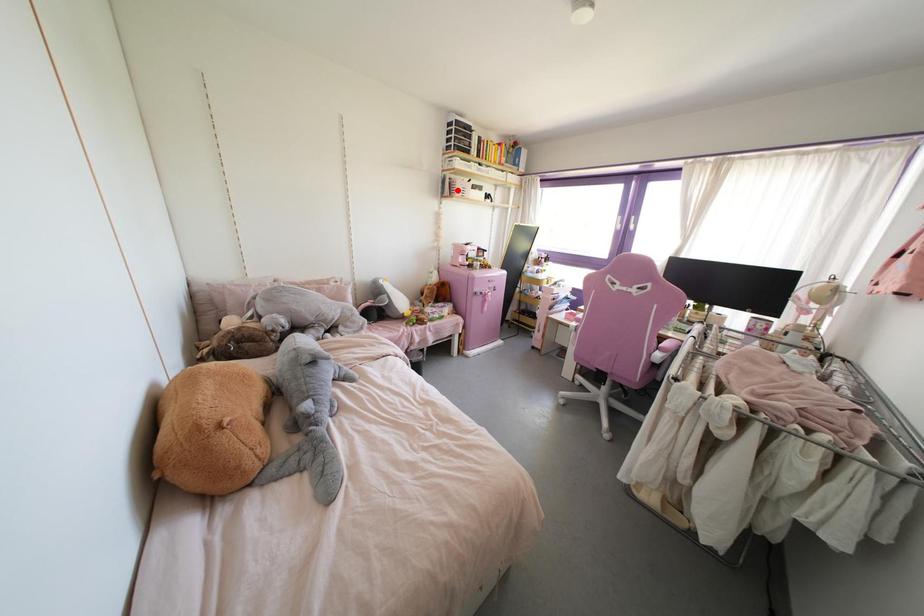
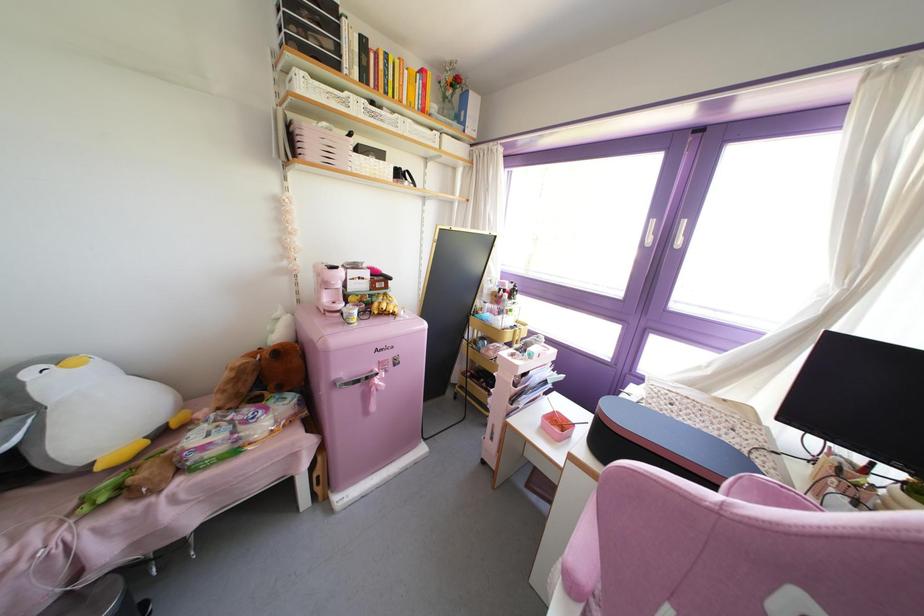
The point at the highlighted location is marked in the first image. Where is the corresponding point in the second image?

(310, 148)